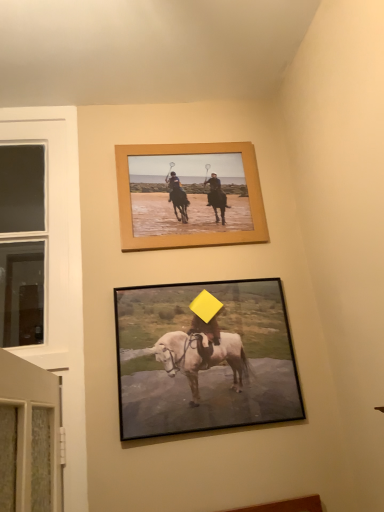
Question: Is wooden frame at upper center, which is the first picture frame from back to front, inside or outside of matte black horse at center, the 1th picture frame from the front?

Choices:
 (A) inside
 (B) outside

Answer: (B)

Question: From their relative heights in the image, would you say wooden frame at upper center, which is counted as the 2th picture frame, starting from the front, is taller or shorter than matte black horse at center, the second picture frame viewed from the top?

Choices:
 (A) tall
 (B) short

Answer: (B)

Question: Is wooden frame at upper center, positioned as the 1th picture frame in top-to-bottom order, wider or thinner than matte black horse at center, the 1th picture frame from the front?

Choices:
 (A) thin
 (B) wide

Answer: (A)

Question: Is matte black horse at center, which is the 2th picture frame from back to front, inside the boundaries of wooden frame at upper center, which is counted as the 2th picture frame, starting from the front, or outside?

Choices:
 (A) outside
 (B) inside

Answer: (A)

Question: In the image, is matte black horse at center, the second picture frame viewed from the top, on the left side or the right side of wooden frame at upper center, positioned as the 1th picture frame in top-to-bottom order?

Choices:
 (A) left
 (B) right

Answer: (B)

Question: Is point (140, 326) positioned closer to the camera than point (211, 214)?

Choices:
 (A) farther
 (B) closer

Answer: (B)

Question: Is matte black horse at center, which is the first picture frame from bottom to top, in front of or behind wooden frame at upper center, which is the first picture frame from back to front, in the image?

Choices:
 (A) front
 (B) behind

Answer: (A)